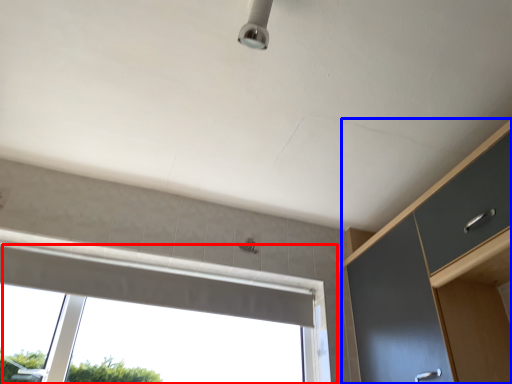
Question: Which of the following is the farthest to the observer, window (highlighted by a red box) or dresser (highlighted by a blue box)?

Choices:
 (A) window
 (B) dresser

Answer: (A)